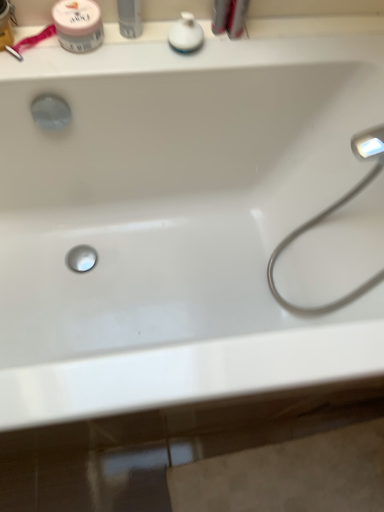
Find the location of a particular element. free space in front of white glossy soap dispenser at upper center, which is counted as the first toiletry, starting from the right is located at coordinates (169, 66).